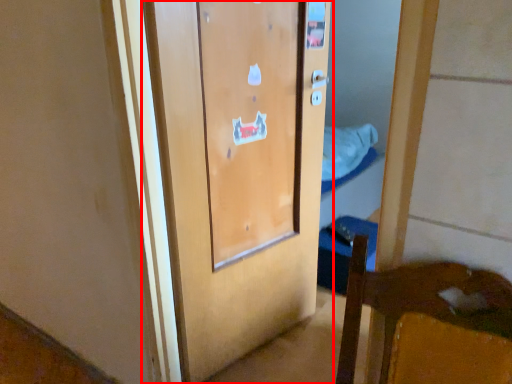
Question: From the image's perspective, what is the correct spatial positioning of door (annotated by the red box) in reference to sheet?

Choices:
 (A) above
 (B) below

Answer: (B)